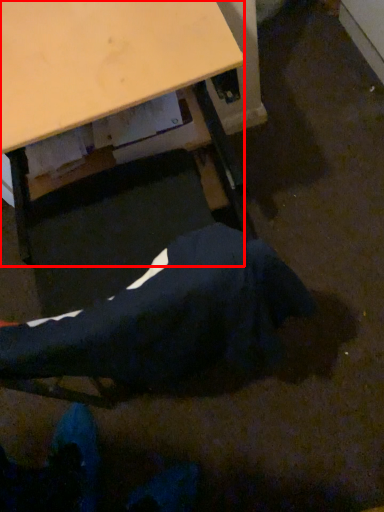
Question: In this image, where is desk (annotated by the red box) located relative to robe?

Choices:
 (A) left
 (B) right

Answer: (A)